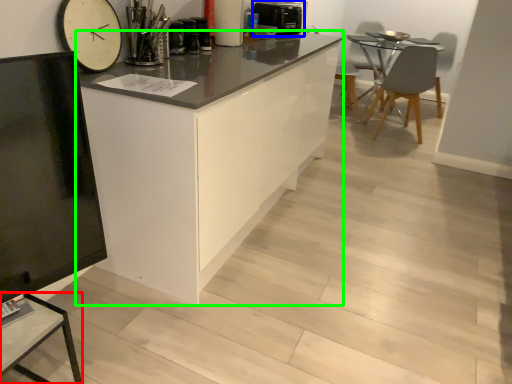
Question: Which object is positioned farthest from table (highlighted by a red box)? Select from appliance (highlighted by a blue box) and cabinetry (highlighted by a green box).

Choices:
 (A) appliance
 (B) cabinetry

Answer: (A)